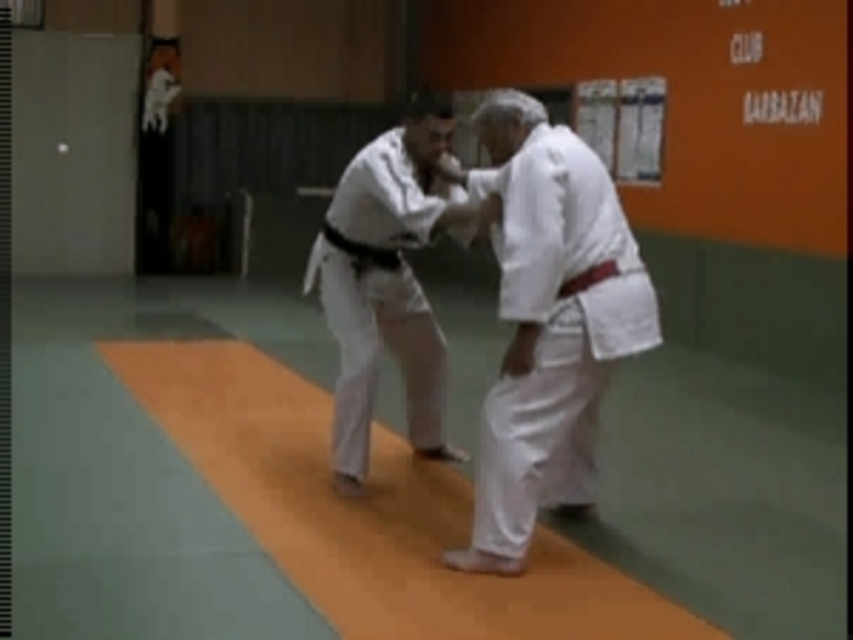
Between white cloth kimono at center and white fabric kimono at center, which one has less height?

white fabric kimono at center

Who is more forward, (500, 518) or (357, 340)?

Point (500, 518)

Is point (585, 513) positioned in front of point (387, 173)?

No, (585, 513) is further to viewer.

Where is `white cloth kimono at center`? The height and width of the screenshot is (640, 853). white cloth kimono at center is located at coordinates (548, 324).